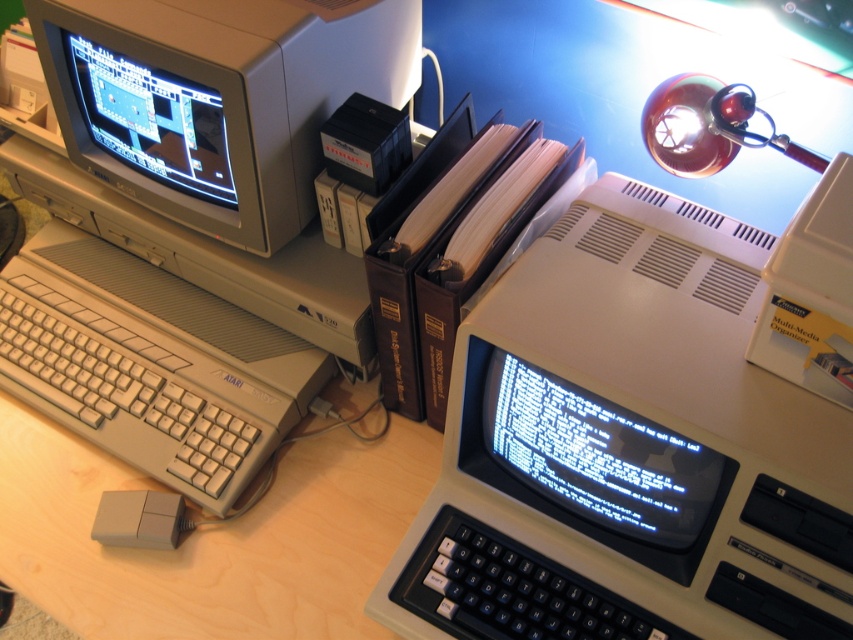
Is matte gray monitor at upper left further to camera compared to shiny plastic monitor at upper left?

No, it is in front of shiny plastic monitor at upper left.

Locate an element on the screen. The width and height of the screenshot is (853, 640). matte gray monitor at upper left is located at coordinates (218, 99).

The height and width of the screenshot is (640, 853). What do you see at coordinates (218, 99) in the screenshot?
I see `matte gray monitor at upper left` at bounding box center [218, 99].

Image resolution: width=853 pixels, height=640 pixels. I want to click on matte gray monitor at upper left, so click(218, 99).

Can you confirm if beige plastic computer at center is wider than matte gray monitor at upper left?

No, beige plastic computer at center is not wider than matte gray monitor at upper left.

In the scene shown: Can you confirm if beige plastic computer at center is positioned to the left of matte gray monitor at upper left?

In fact, beige plastic computer at center is to the right of matte gray monitor at upper left.

The width and height of the screenshot is (853, 640). I want to click on beige plastic computer at center, so click(628, 449).

Find the location of a particular element. The width and height of the screenshot is (853, 640). beige plastic computer at center is located at coordinates (628, 449).

Image resolution: width=853 pixels, height=640 pixels. What are the coordinates of `beige plastic computer at center` in the screenshot? It's located at (628, 449).

Which is behind, point (711, 221) or point (814, 156)?

The point (711, 221) is more distant.

Is point (579, 557) less distant than point (672, 141)?

Yes.

Where is `beige plastic computer at center`? This screenshot has width=853, height=640. beige plastic computer at center is located at coordinates (628, 449).